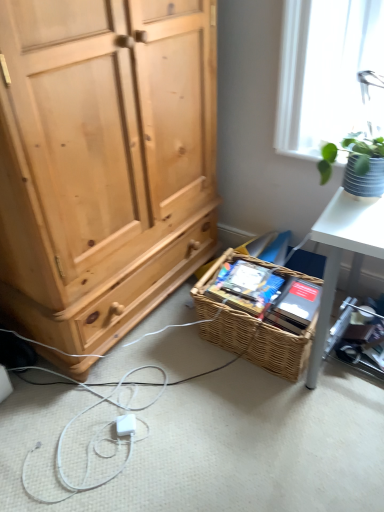
Question: Considering the positions of woven brown picnic basket at lower center and textured gray pot at upper right in the image, is woven brown picnic basket at lower center taller or shorter than textured gray pot at upper right?

Choices:
 (A) short
 (B) tall

Answer: (B)

Question: Is woven brown picnic basket at lower center bigger or smaller than textured gray pot at upper right?

Choices:
 (A) small
 (B) big

Answer: (B)

Question: Estimate the real-world distances between objects in this image. Which object is closer to the white plastic desk at right?

Choices:
 (A) woven brown picnic basket at lower center
 (B) textured gray pot at upper right

Answer: (A)

Question: Which object is the closest to the white plastic desk at right?

Choices:
 (A) woven brown picnic basket at lower center
 (B) textured gray pot at upper right

Answer: (A)